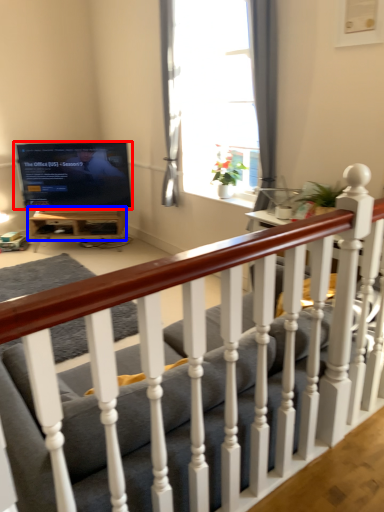
Question: Which object appears farthest to the camera in this image, television (highlighted by a red box) or table (highlighted by a blue box)?

Choices:
 (A) television
 (B) table

Answer: (B)